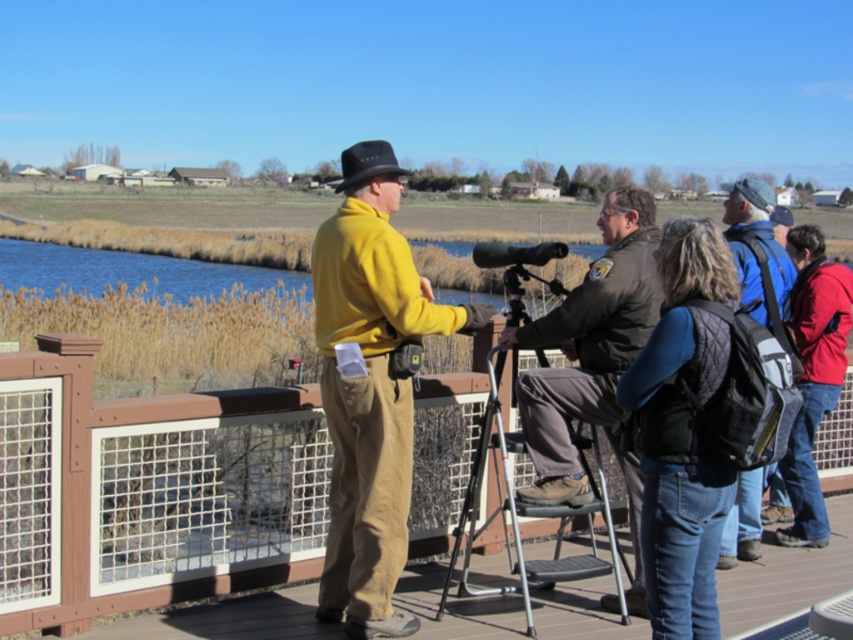
You are standing on the wooden deck overlooking the water. There are two points marked on the deck. The first point is at coordinates point (781, 544) and the second point is at point (758, 211). Which point is closer to you?

Point (758, 211) is closer to you because point (781, 544) is behind it.